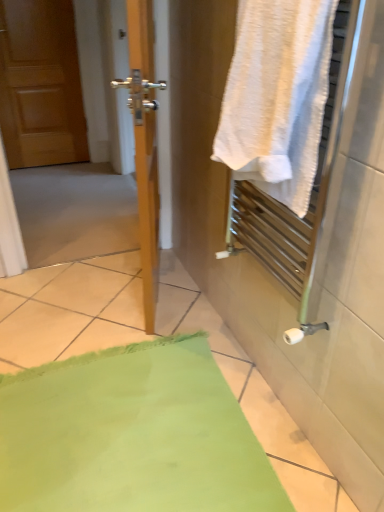
Question: Could wooden screen door at left be considered to be inside white textured towel at right?

Choices:
 (A) yes
 (B) no

Answer: (B)

Question: Is white textured towel at right to the right of wooden screen door at left from the viewer's perspective?

Choices:
 (A) yes
 (B) no

Answer: (A)

Question: Can you confirm if white textured towel at right is smaller than wooden screen door at left?

Choices:
 (A) yes
 (B) no

Answer: (A)

Question: Is white textured towel at right looking in the opposite direction of wooden screen door at left?

Choices:
 (A) yes
 (B) no

Answer: (B)

Question: Are white textured towel at right and wooden screen door at left located far from each other?

Choices:
 (A) no
 (B) yes

Answer: (A)

Question: Does white textured towel at right have a greater height compared to wooden screen door at left?

Choices:
 (A) no
 (B) yes

Answer: (A)

Question: Are wooden screen door at left and matte wood door at left making contact?

Choices:
 (A) no
 (B) yes

Answer: (A)

Question: Considering the relative positions of wooden screen door at left and matte wood door at left in the image provided, is wooden screen door at left in front of matte wood door at left?

Choices:
 (A) yes
 (B) no

Answer: (A)

Question: Is wooden screen door at left bigger than matte wood door at left?

Choices:
 (A) yes
 (B) no

Answer: (A)

Question: Would you say wooden screen door at left is outside matte wood door at left?

Choices:
 (A) no
 (B) yes

Answer: (B)

Question: Can you confirm if wooden screen door at left is thinner than matte wood door at left?

Choices:
 (A) no
 (B) yes

Answer: (A)

Question: Could you tell me if wooden screen door at left is turned towards matte wood door at left?

Choices:
 (A) no
 (B) yes

Answer: (A)

Question: Does wooden screen door at left have a smaller size compared to green fabric bath mat at lower left?

Choices:
 (A) no
 (B) yes

Answer: (A)